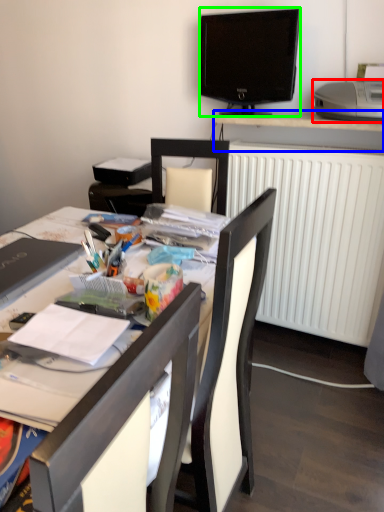
Question: Which object is the farthest from printer (highlighted by a red box)? Choose among these: desk (highlighted by a blue box) or television (highlighted by a green box).

Choices:
 (A) desk
 (B) television

Answer: (B)